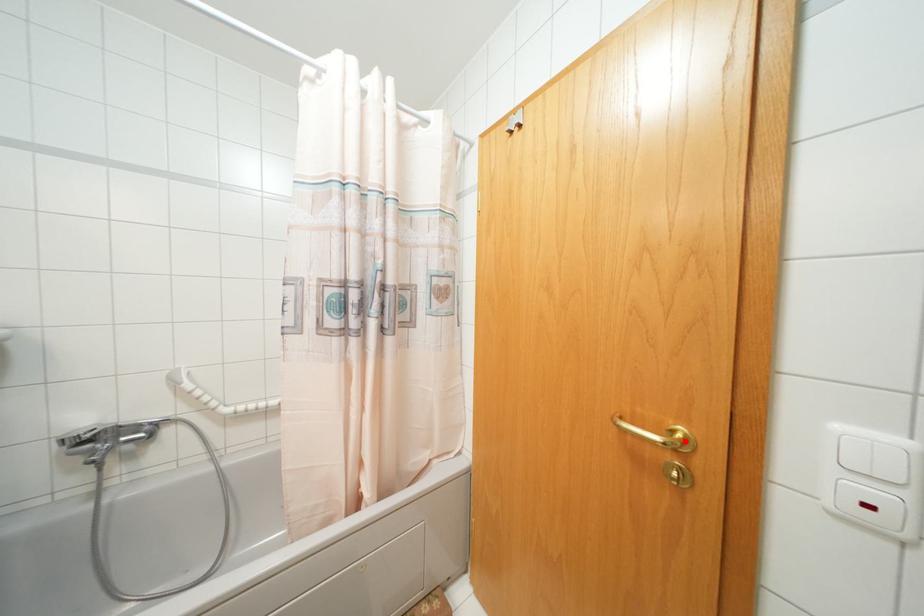
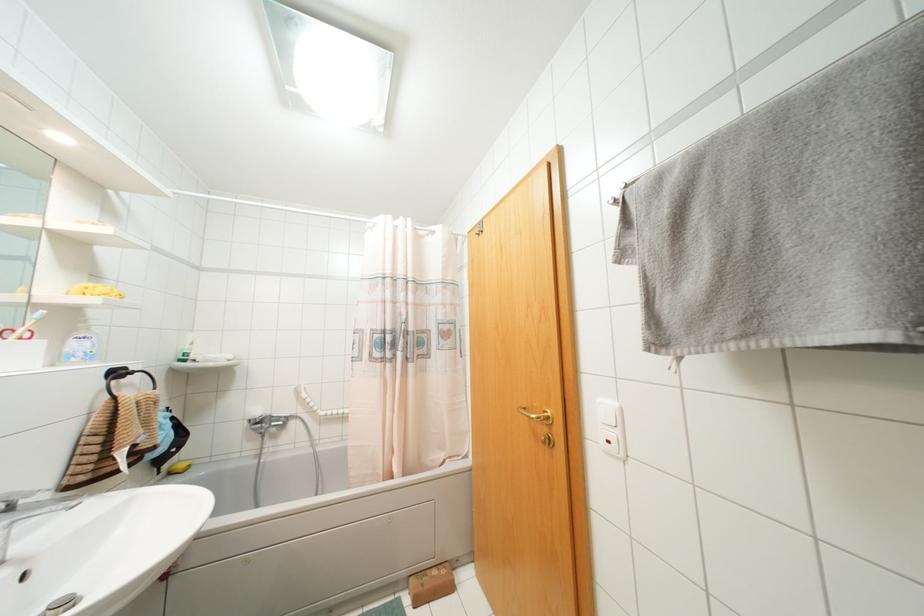
Locate, in the second image, the point that corresponds to the highlighted location in the first image.

(546, 416)